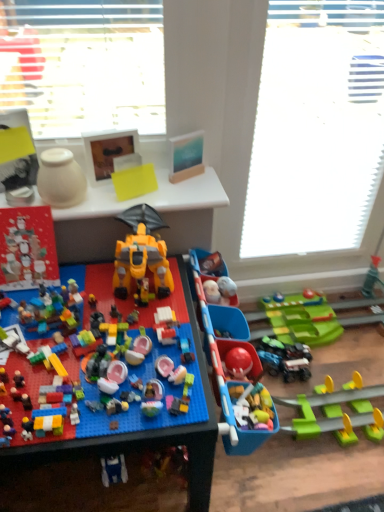
You are a GUI agent. You are given a task and a screenshot of the screen. Output one action in this format:
    pyautogui.click(x=<x>, y=<y>)
    Task: Click on the vacant area situated below translucent plastic spaceship at center, arranged as the third toy when viewed from the right (from a real-world perspective)
    This screenshot has width=384, height=512.
    Given the screenshot: What is the action you would take?
    pyautogui.click(x=94, y=356)